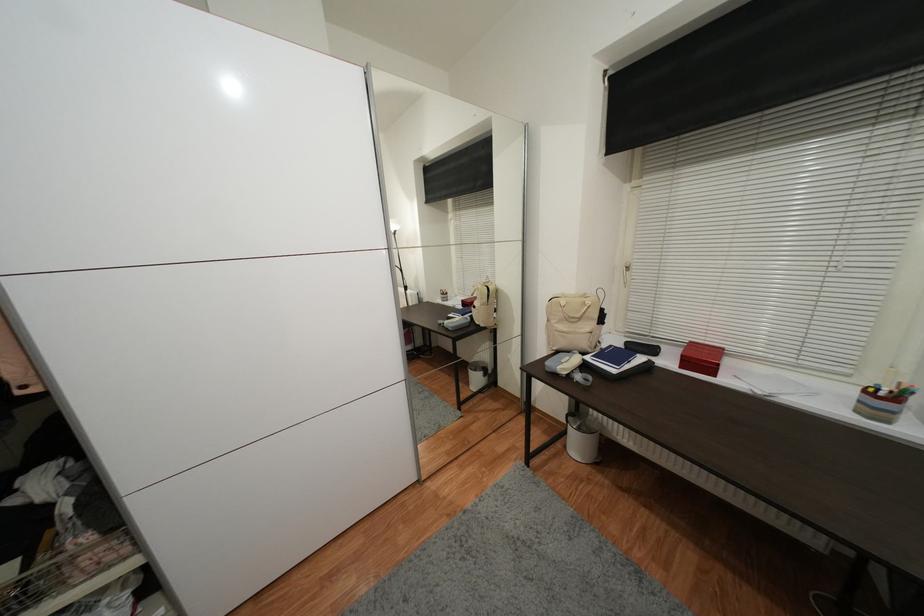
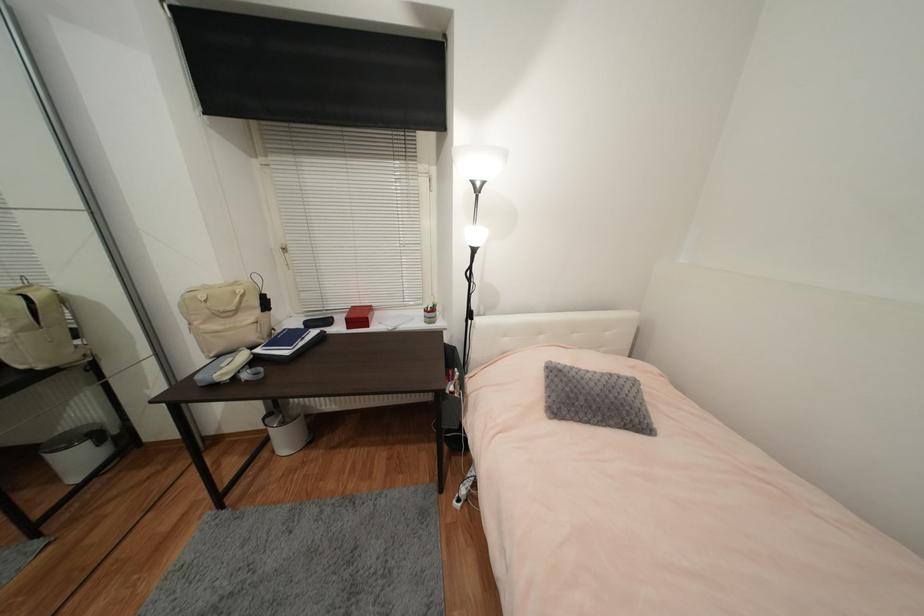
Where in the second image is the point corresponding to point (481, 381) from the first image?

(83, 462)